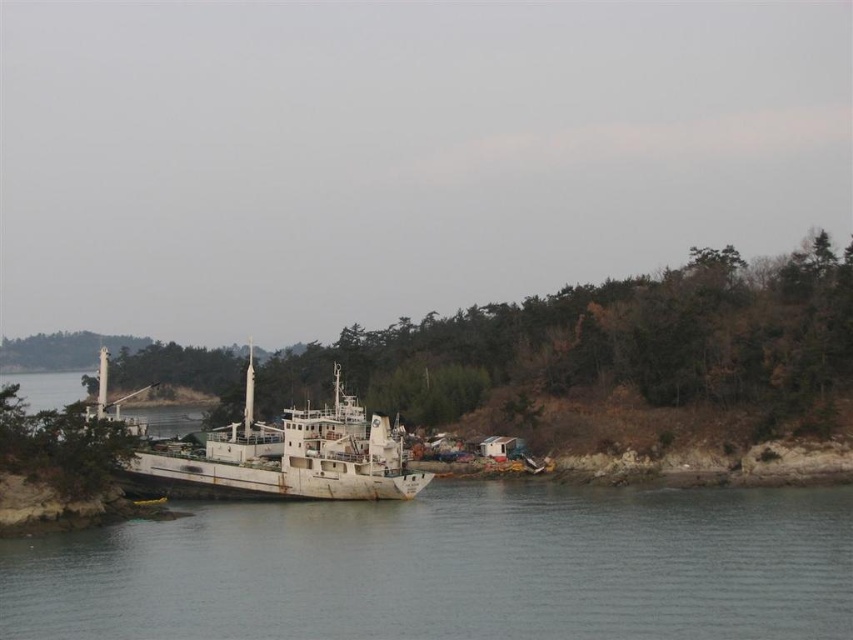
Is point (813, 563) farther from viewer compared to point (241, 448)?

That is False.

Can you confirm if rusty metallic water at lower center is wider than rusty metal boat at center?

No.

The height and width of the screenshot is (640, 853). What do you see at coordinates (451, 568) in the screenshot?
I see `rusty metallic water at lower center` at bounding box center [451, 568].

Locate an element on the screen. The image size is (853, 640). rusty metallic water at lower center is located at coordinates (451, 568).